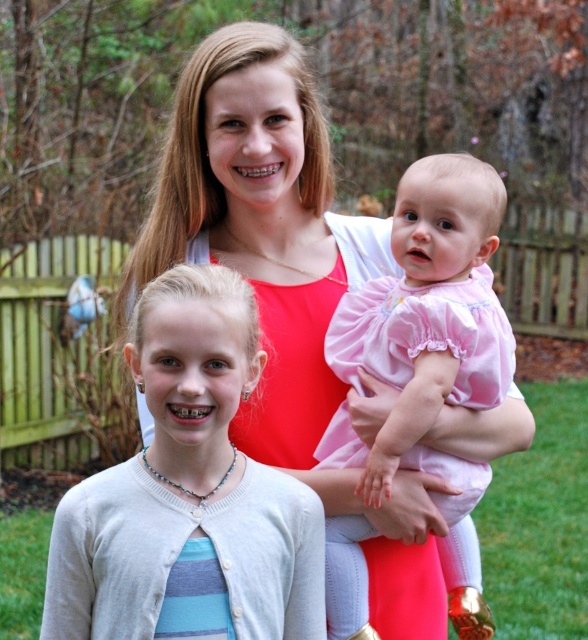
You are standing at point (x=437, y=564) and want to reach the wooden fence in the background. The distance between you and the wooden fence is 2.81 meters. If you can walk 1.5 meters in 1 second, how many seconds will it take you to reach the wooden fence?

The distance between you and the wooden fence is 2.81 meters. Since you can walk 1.5 meters in 1 second, it will take approximately 1.87 seconds to reach the wooden fence.